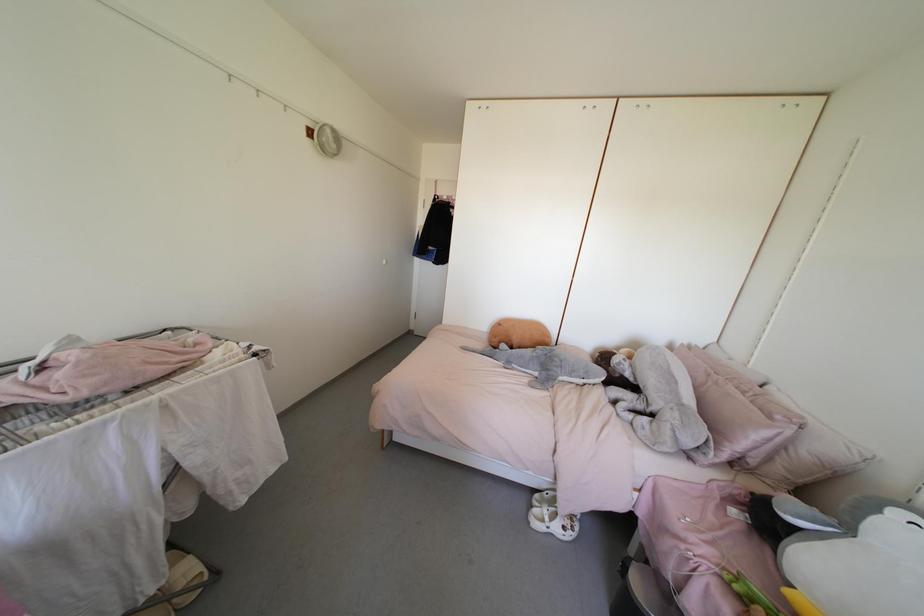
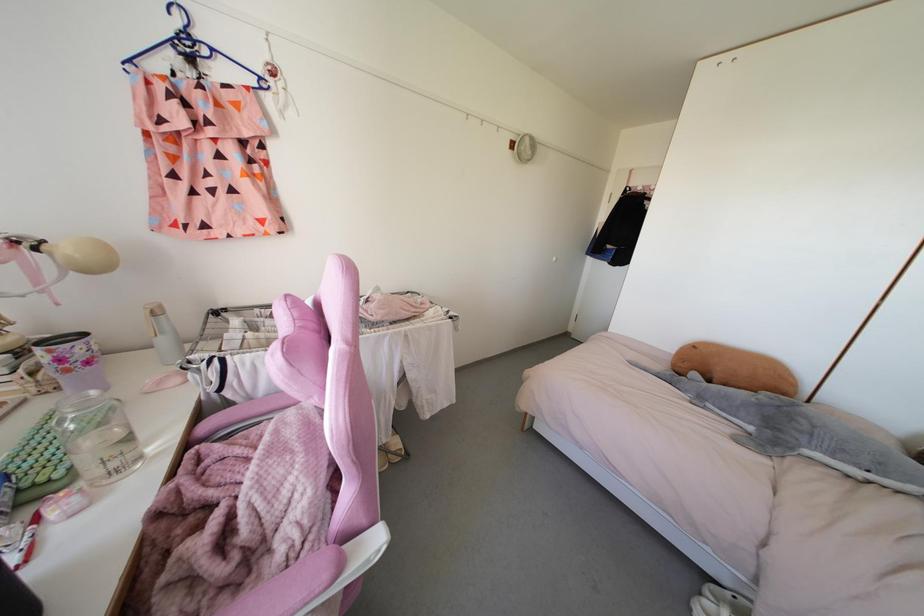
Find the pixel in the second image that matches (383,262) in the first image.

(553, 257)